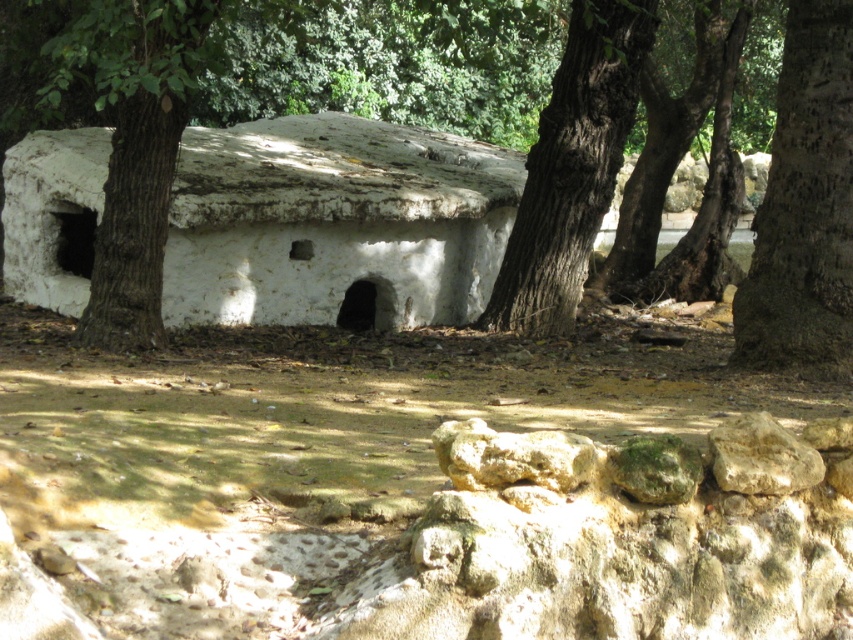
Question: Can you confirm if rough bark tree at right is positioned to the left of smooth beige rock at lower right?

Choices:
 (A) no
 (B) yes

Answer: (A)

Question: Can you confirm if white stucco hut at center is positioned above smooth beige rock at lower right?

Choices:
 (A) yes
 (B) no

Answer: (A)

Question: Which point is farther to the camera?

Choices:
 (A) (726, 420)
 (B) (212, 138)

Answer: (B)

Question: Is brown rough tree at center wider than rough bark tree at right?

Choices:
 (A) no
 (B) yes

Answer: (A)

Question: Which point is closer to the camera?

Choices:
 (A) smooth beige rock at lower right
 (B) brown rough tree at center
 (C) white stucco hut at center
 (D) rough bark tree at right

Answer: (A)

Question: Among these objects, which one is farthest from the camera?

Choices:
 (A) white stucco hut at center
 (B) rough bark tree at right

Answer: (A)